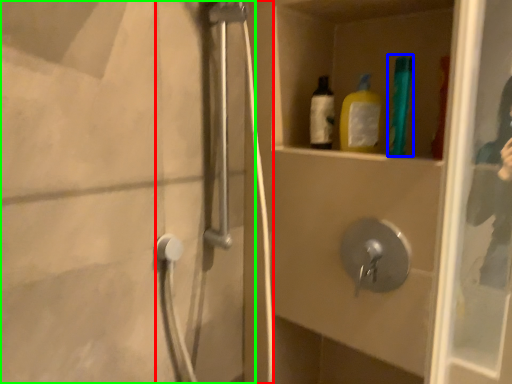
Question: Which object is positioned farthest from shower door (highlighted by a red box)? Select from bottle (highlighted by a blue box) and screen door (highlighted by a green box).

Choices:
 (A) bottle
 (B) screen door

Answer: (A)